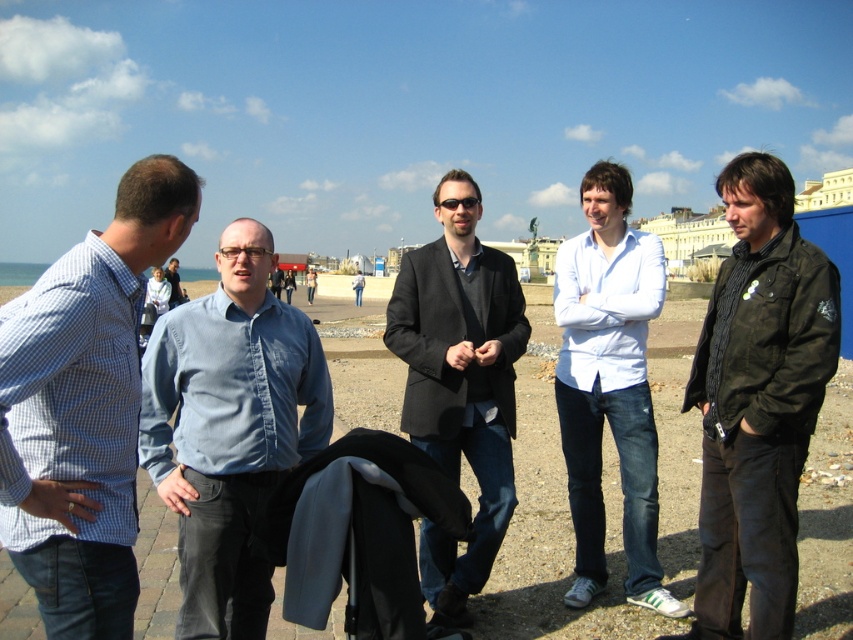
Question: Can you confirm if checkered fabric shirt at left is positioned to the right of dark green leather jacket at right?

Choices:
 (A) yes
 (B) no

Answer: (B)

Question: Is dark green leather jacket at right to the left of blue denim shirt at center from the viewer's perspective?

Choices:
 (A) yes
 (B) no

Answer: (B)

Question: Among these objects, which one is nearest to the camera?

Choices:
 (A) blue denim shirt at center
 (B) smooth sand at center
 (C) white matte shirt at center
 (D) matte black jacket at center

Answer: (A)

Question: Which is farther from the blue denim shirt at center?

Choices:
 (A) dark green leather jacket at right
 (B) smooth sand at center

Answer: (A)

Question: Among these objects, which one is farthest from the camera?

Choices:
 (A) smooth sand at center
 (B) blue denim shirt at center

Answer: (A)

Question: Is blue denim shirt at center behind white matte shirt at center?

Choices:
 (A) yes
 (B) no

Answer: (B)